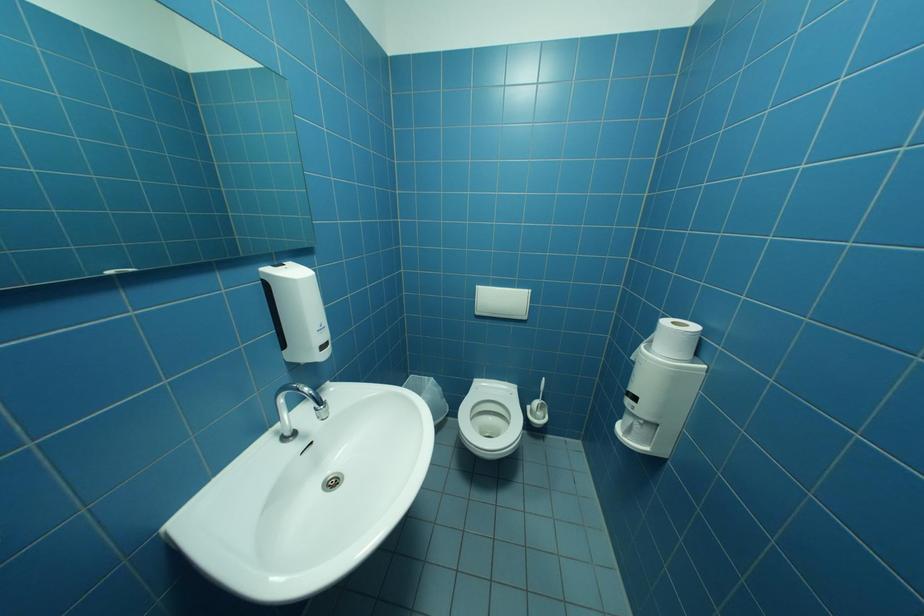
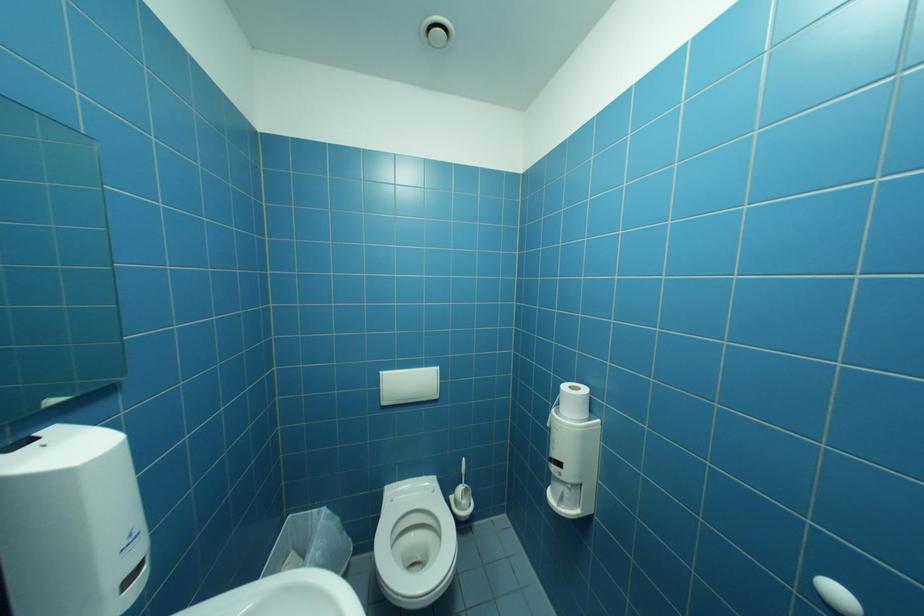
Question: The first image is from the beginning of the video and the second image is from the end. How did the camera likely rotate when shooting the video?

Choices:
 (A) Left
 (B) Right
 (C) Up
 (D) Down

Answer: (B)